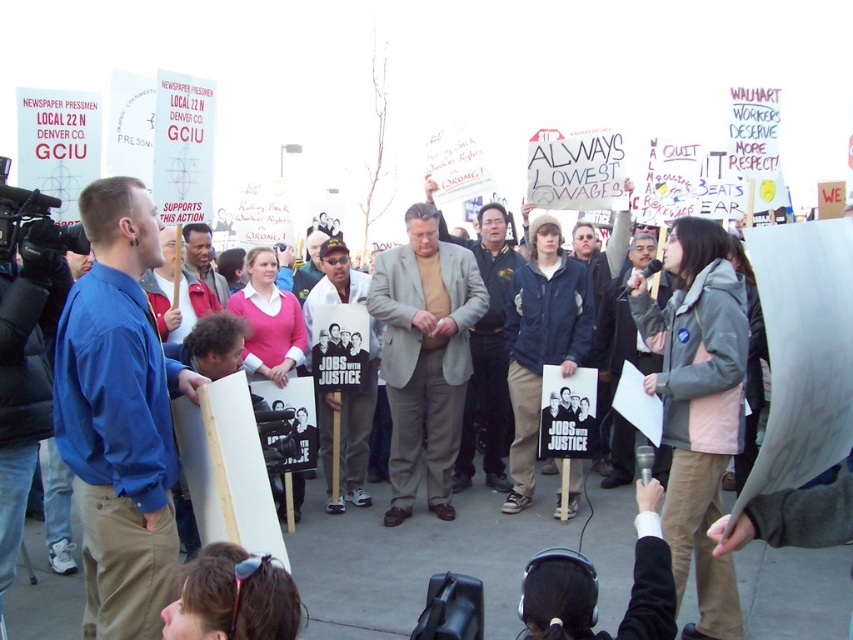
Is point (167, 582) positioned after point (463, 458)?

No, it is not.

Which is in front, point (102, 545) or point (486, 228)?

Point (102, 545) is more forward.

Find the location of `blue cotton shirt at left`. blue cotton shirt at left is located at coordinates (119, 417).

Between point (135, 397) and point (363, 387), which one is positioned behind?

Positioned behind is point (363, 387).

Is point (86, 426) positioned before point (355, 496)?

Yes, it is in front of point (355, 496).

This screenshot has height=640, width=853. What do you see at coordinates (119, 417) in the screenshot?
I see `blue cotton shirt at left` at bounding box center [119, 417].

The width and height of the screenshot is (853, 640). Identify the location of blue cotton shirt at left. (119, 417).

Which is below, white cotton shirt at center or reddish-brown leather jacket at center?

white cotton shirt at center is lower down.

Is point (370, 330) positioned in front of point (212, 257)?

No, (370, 330) is further to viewer.

I want to click on white cotton shirt at center, so click(x=350, y=429).